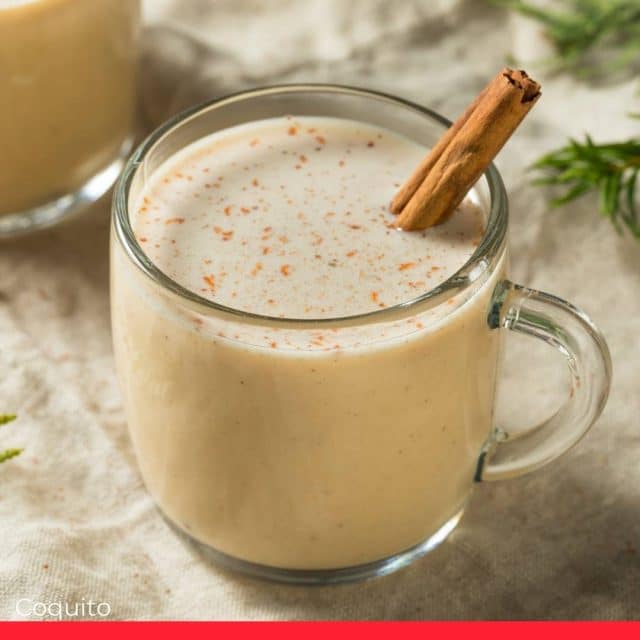
This screenshot has height=640, width=640. Find the location of `glass`. glass is located at coordinates (323, 374).